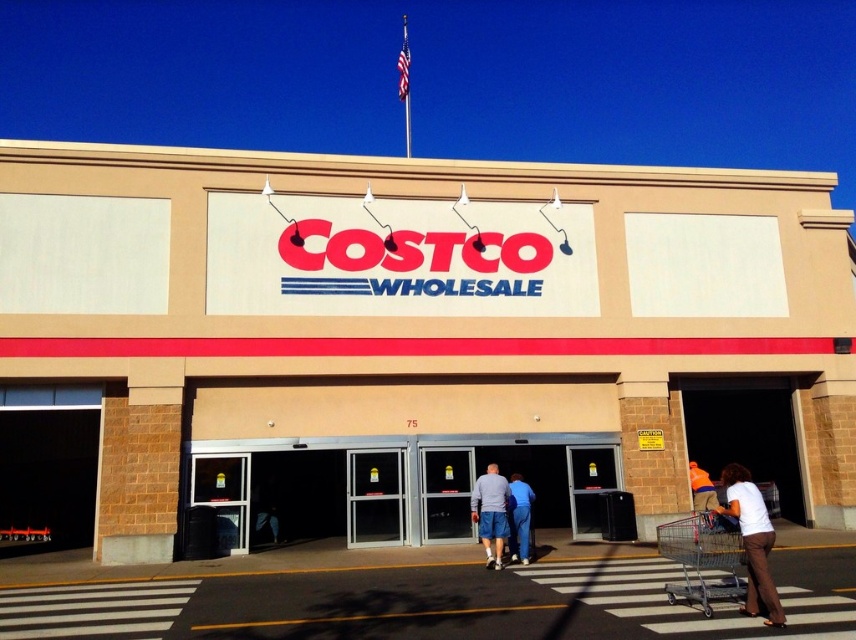
Question: Is matte glass doors at center closer to camera compared to white cotton shirt at lower right?

Choices:
 (A) no
 (B) yes

Answer: (A)

Question: Which object is positioned closest to the matte glass doors at center?

Choices:
 (A) orange fabric shirt at lower right
 (B) matte gray shirt at center

Answer: (B)

Question: Estimate the real-world distances between objects in this image. Which object is farther from the orange fabric shirt at lower right?

Choices:
 (A) matte gray shirt at center
 (B) white cotton shirt at lower right

Answer: (B)

Question: Which point is closer to the camera?

Choices:
 (A) white cotton shirt at lower right
 (B) orange fabric shirt at lower right
 (C) matte glass doors at center
 (D) matte gray shirt at center

Answer: (A)

Question: Is metallic gray shopping cart at lower right to the right of matte gray shirt at center from the viewer's perspective?

Choices:
 (A) yes
 (B) no

Answer: (A)

Question: Does beige/brick wall at center appear on the right side of blue cotton pants at center?

Choices:
 (A) yes
 (B) no

Answer: (B)